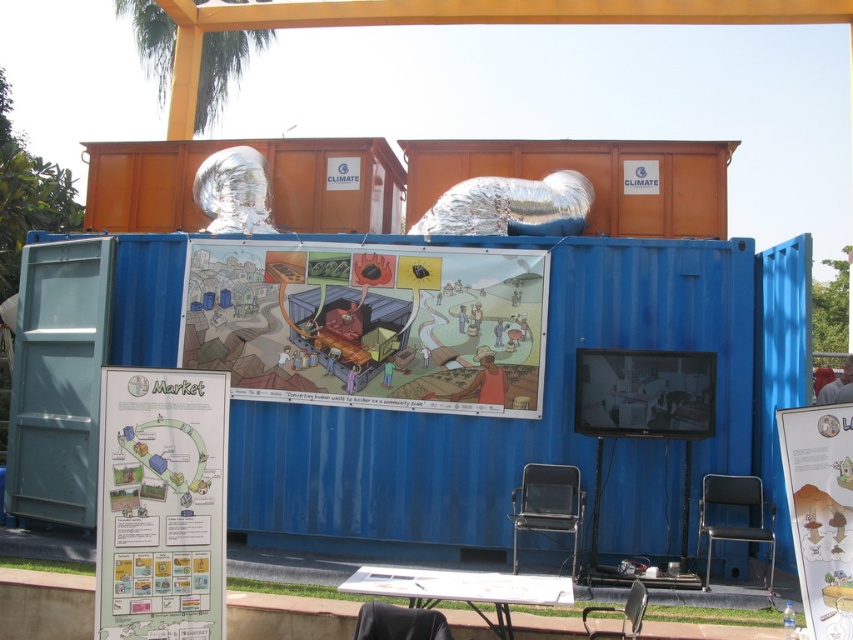
You are organizing a climate awareness event and have a white paper at center and a matte white poster at center displayed. Which one can be seen from a greater distance?

The white paper at center is bigger than the matte white poster at center, so the white paper at center can be seen from a greater distance.

In the scene shown: You are a visitor at this climate awareness event and see the cartoon illustration at center and the white paper at center. Which one is positioned higher?

The cartoon illustration at center is positioned higher than the white paper at center.